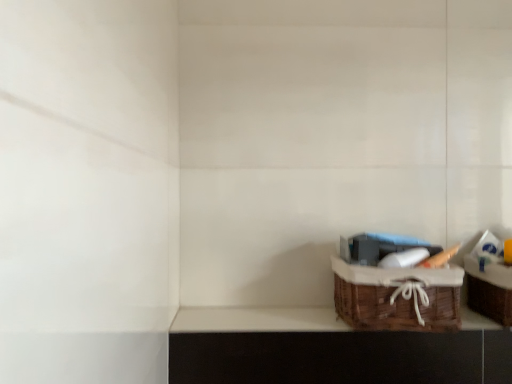
Identify the location of free space to the left of woven brown picnic basket at lower right. This screenshot has width=512, height=384. (295, 319).